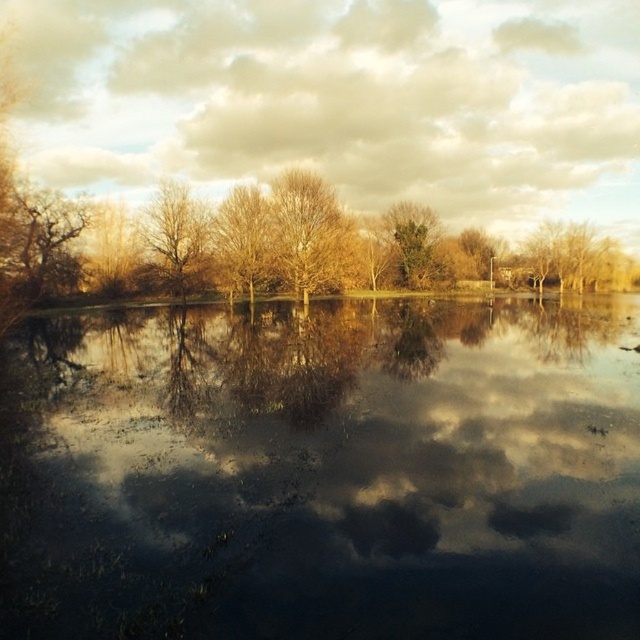
You are a bird looking for a place to land. You see the bare branches at center. How far apart are they?

The bare branches at center are 52.22 meters apart.

You are an artist planning to paint the scene. You want to ensure the proportions of the brown textured tree at left and the bare branches at center match their actual sizes. Which object should you paint larger?

The brown textured tree at left should be painted larger than the bare branches at center because it has a larger size compared to them.

You are a bird flying over the serene landscape depicted in the image. You want to land on the brown textured tree at left. Based on its position coordinates, can you estimate how far it is from the center of the image?

The brown textured tree at left is located at coordinates point (42,241), which places it relatively close to the upper left quadrant of the image, making it approximately 15 meters away from the center. However, without additional information about the image dimensions or scale, this is an approximate estimate.